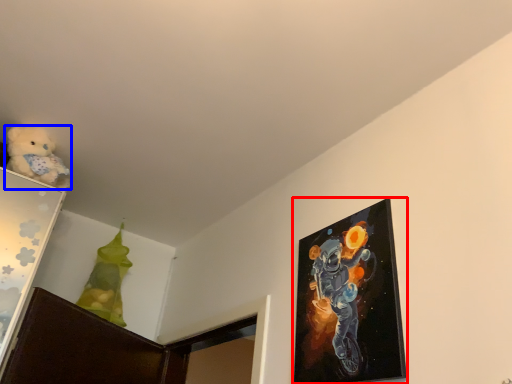
Question: Among these objects, which one is nearest to the camera, picture frame (highlighted by a red box) or teddy bear (highlighted by a blue box)?

Choices:
 (A) picture frame
 (B) teddy bear

Answer: (A)